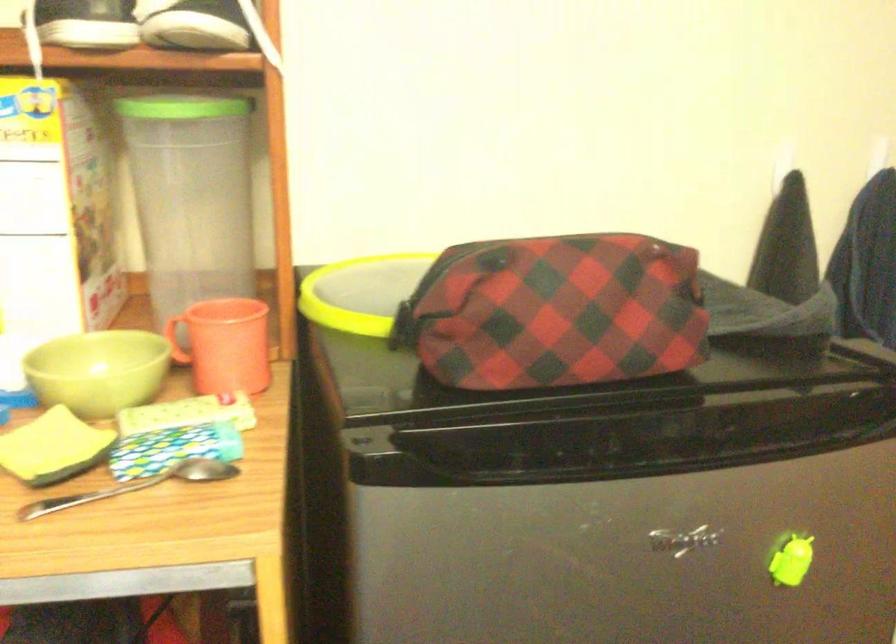
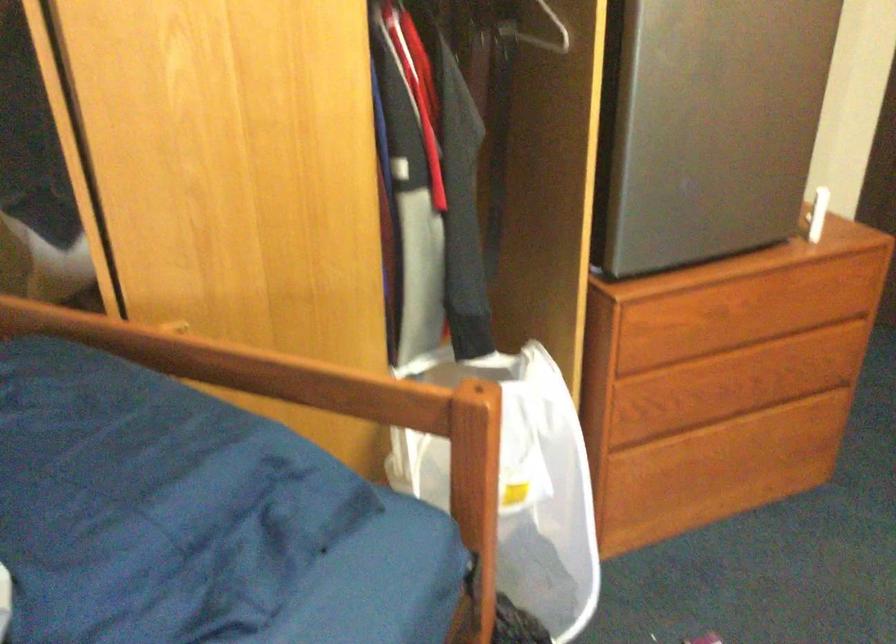
Which direction would the cameraman need to move to produce the second image?

The movement direction of the cameraman is left, backward.